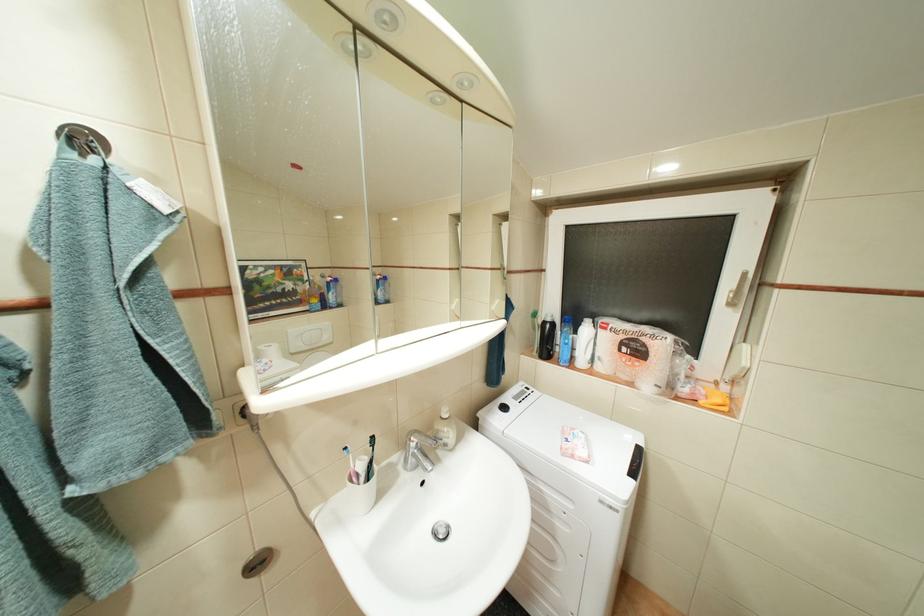
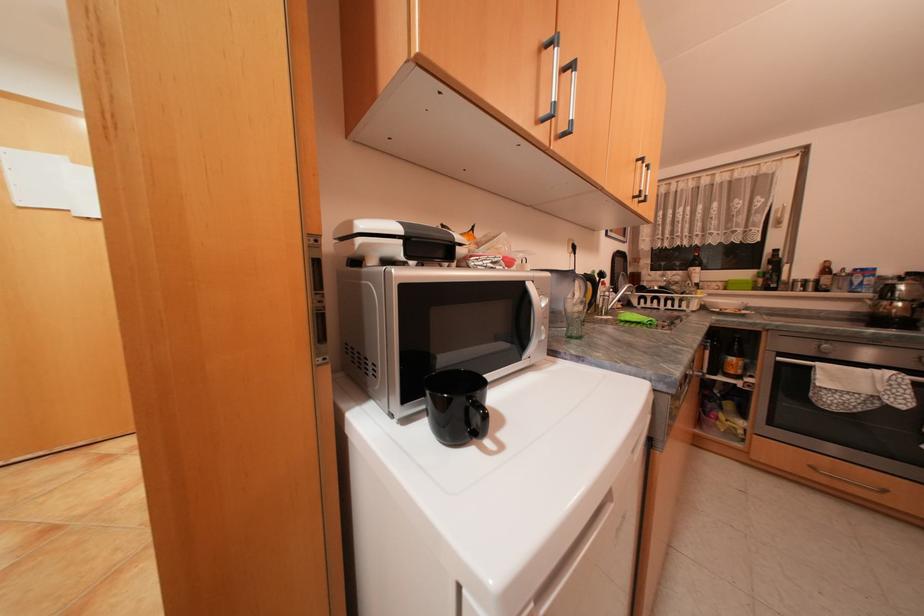
Question: Which direction would the cameraman need to move to produce the second image? Reply with the corresponding letter.

Choices:
 (A) Left
 (B) Right
 (C) Forward
 (D) Backward

Answer: (D)